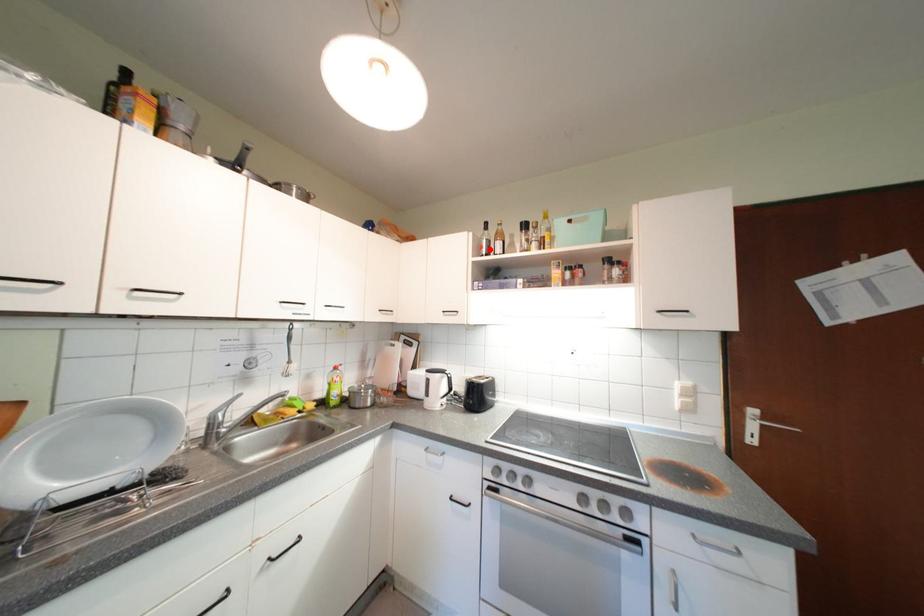
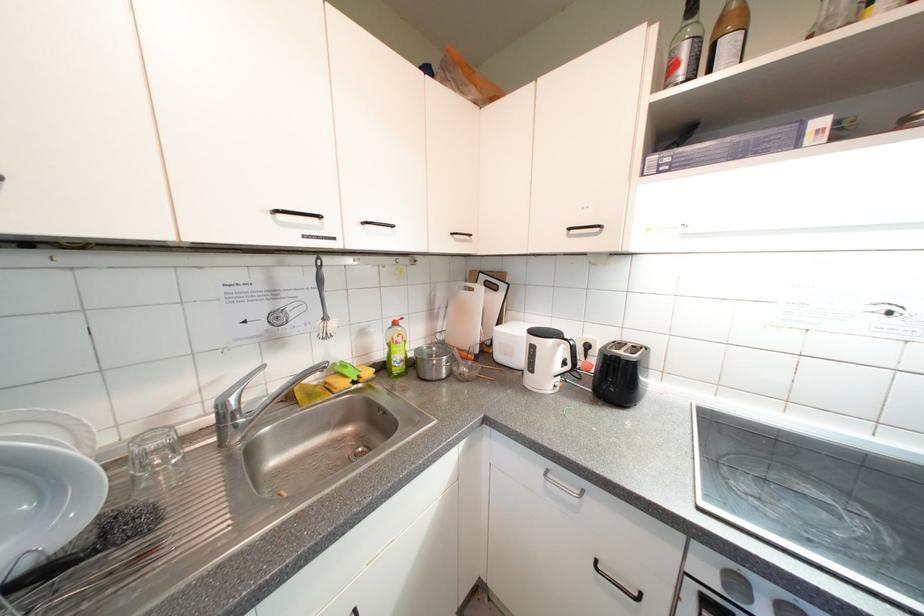
Where in the second image is the point corresponding to the highlighted location from the first image?

(683, 68)